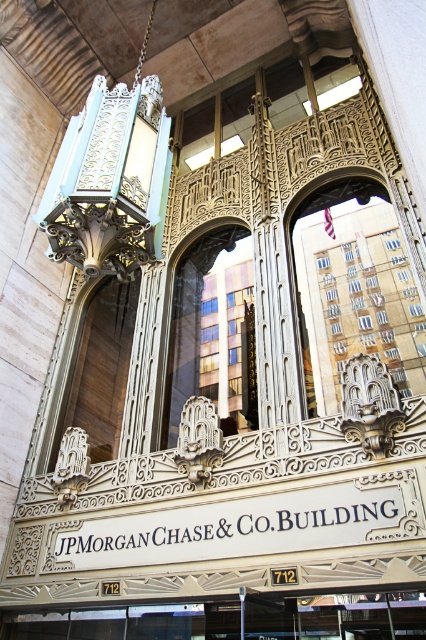
From the picture: You are an architect examining the facade of the JPMorgan Chase Building. You notice the wooden at center and the gold ornate frame at center. Which object is positioned closer to the entrance of the building?

The wooden at center is closer to the entrance because the gold ornate frame at center is positioned behind it.